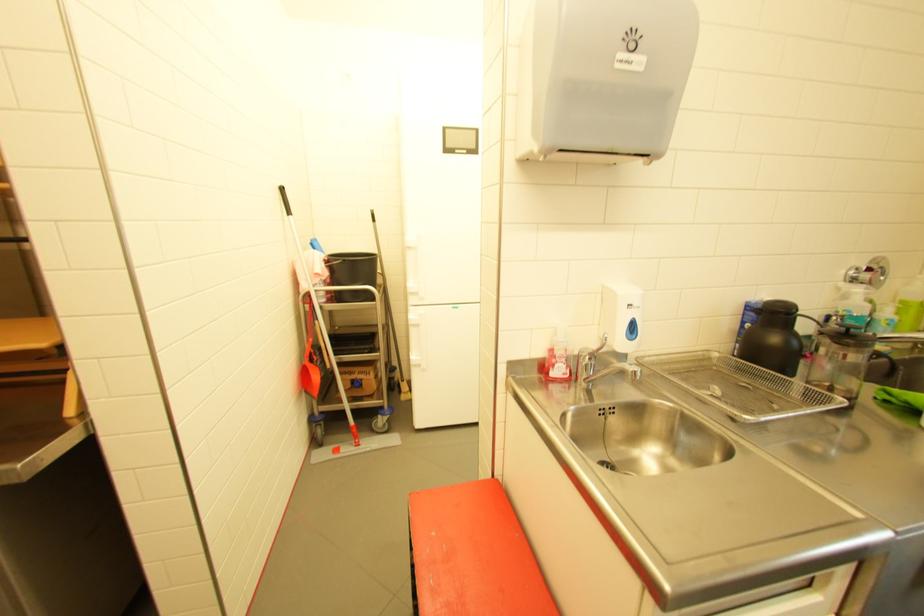
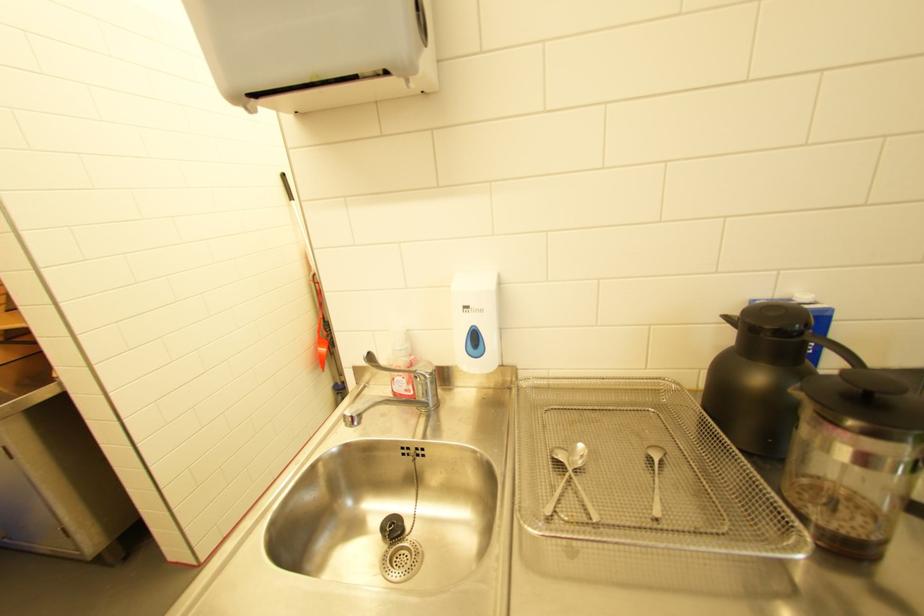
In the second image, find the point that corresponds to the point at 598,360 in the first image.

(423, 378)